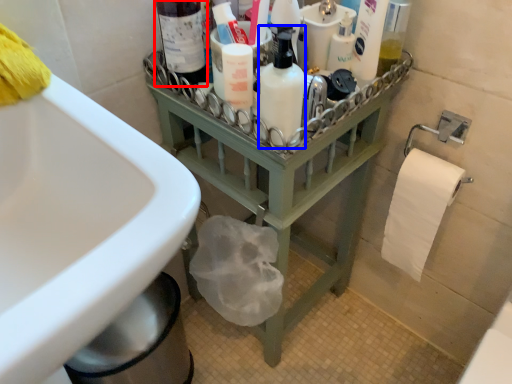
Question: Which of the following is the farthest to the observer, bottle (highlighted by a red box) or cleaning product (highlighted by a blue box)?

Choices:
 (A) bottle
 (B) cleaning product

Answer: (A)